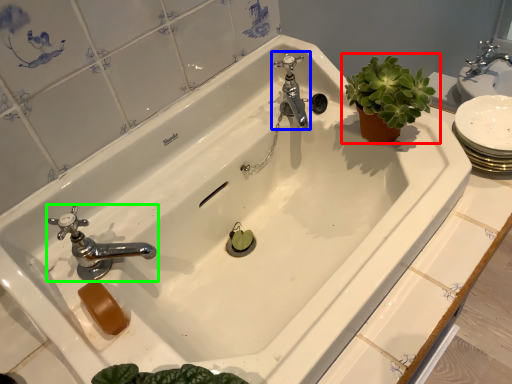
Question: Which object is the farthest from houseplant (highlighted by a red box)? Choose among these: tap (highlighted by a blue box) or tap (highlighted by a green box).

Choices:
 (A) tap
 (B) tap

Answer: (B)